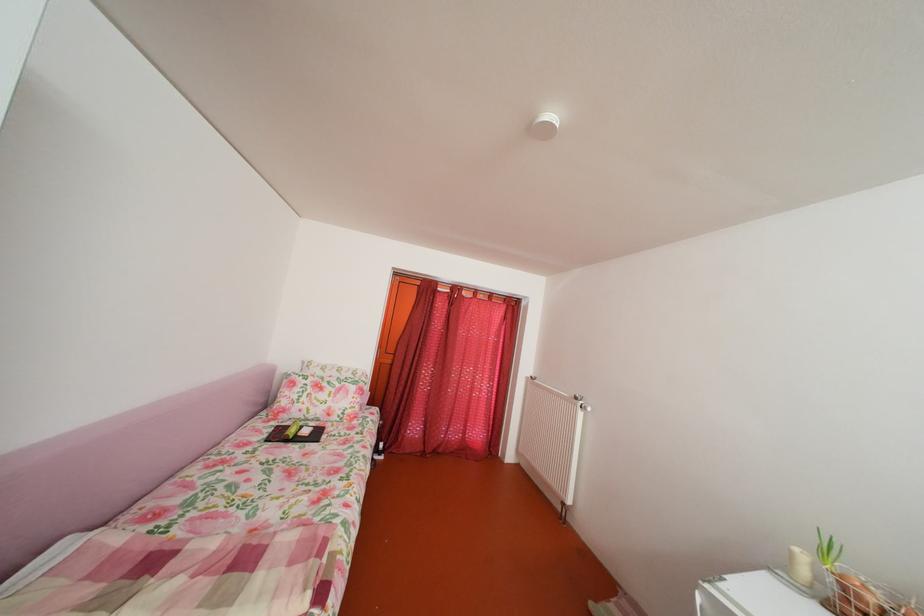
Find the location of a particular element. white pillar candle is located at coordinates point(799,565).